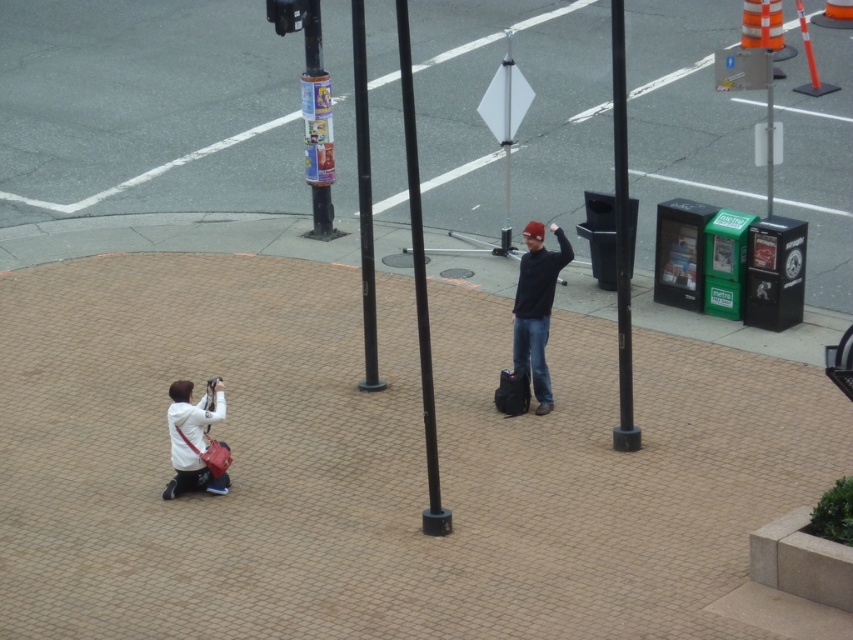
Who is more forward, (234,362) or (564,236)?

Point (564,236)

Does brown textured pavement at lower center have a greater width compared to matte black jacket at center?

In fact, brown textured pavement at lower center might be narrower than matte black jacket at center.

This screenshot has width=853, height=640. Find the location of `brown textured pavement at lower center`. brown textured pavement at lower center is located at coordinates click(374, 464).

Is black matte pole at center above matte black jacket at center?

Yes.

What do you see at coordinates (419, 284) in the screenshot?
I see `black matte pole at center` at bounding box center [419, 284].

Where is `black matte pole at center`? The width and height of the screenshot is (853, 640). black matte pole at center is located at coordinates (419, 284).

Which is in front, point (621, 198) or point (355, 26)?

Point (621, 198) is more forward.

Is black plastic pole at center positioned in front of black metal pole at center?

Yes, it is in front of black metal pole at center.

Is point (624, 378) less distant than point (363, 180)?

Yes, it is in front of point (363, 180).

Identify the location of black plastic pole at center. (621, 236).